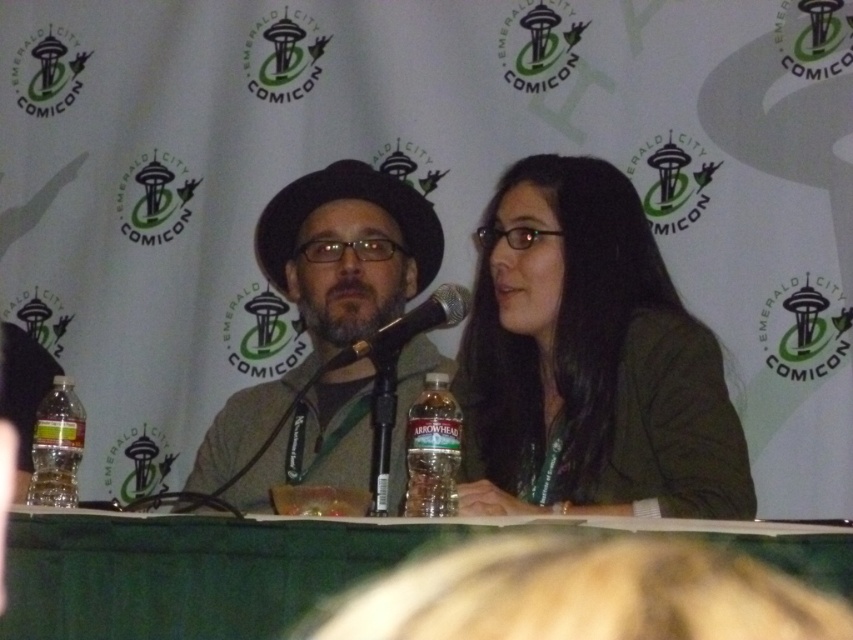
You are a photographer at the Emerald City Comicon panel discussion. You need to capture a closeup shot of the green matte jacket at center and the translucent plastic bottle at center. Which object should you focus on first if you want to start with the one closer to the left side of the frame?

The translucent plastic bottle at center is closer to the left side of the frame because the green matte jacket at center is to the right of it.

You are a photographer who needs to capture a closeup shot of the green matte jacket at center and the black matte microphone at center without moving either object. Given that your camera can only focus on objects within a 25 cm range, will you be able to get both items in focus?

The green matte jacket at center and the black matte microphone at center are 30.82 centimeters apart. Since the distance between them exceeds the camera focus range of 25 cm, you won not be able to capture both in focus simultaneously.

You are a photographer at the Emerald City Comicon event. You need to capture a photo of the matte brown hat at center and the clear plastic bottle at lower left. Which object should you adjust your camera focus to first if you want to ensure both are in frame?

The clear plastic bottle at lower left should be focused on first because the matte brown hat at center is to the right of it, so adjusting focus starting from the left will help in framing both objects properly.